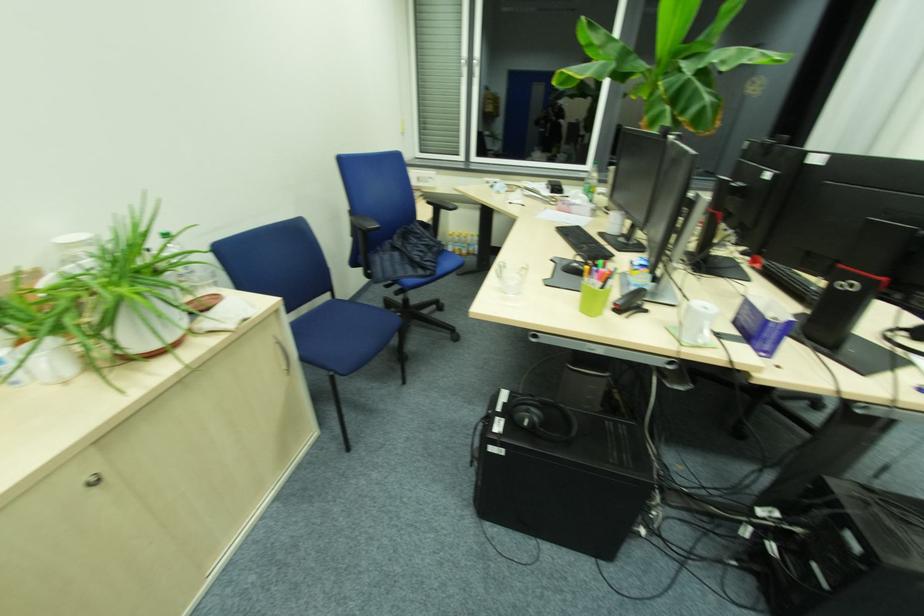
Find where to resting arm on the chair armrest. Please return your answer as a coordinate pair (x, y).

(362, 223)